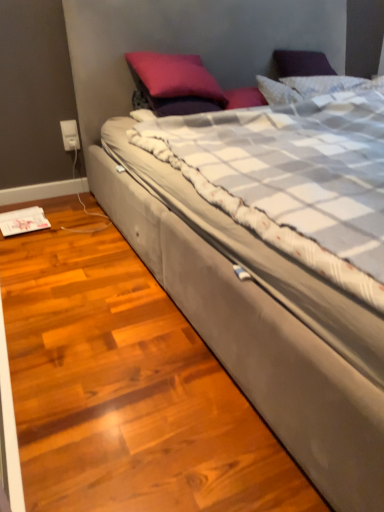
Question: Would you say suede bed at center is to the left or to the right of white plastic electric outlet at lower left in the picture?

Choices:
 (A) left
 (B) right

Answer: (B)

Question: Is suede bed at center in front of or behind white plastic electric outlet at lower left in the image?

Choices:
 (A) behind
 (B) front

Answer: (B)

Question: Which is farther from the satin purple pillow at upper center?

Choices:
 (A) suede bed at center
 (B) white plastic electric outlet at lower left

Answer: (A)

Question: Estimate the real-world distances between objects in this image. Which object is closer to the white plastic electric outlet at lower left?

Choices:
 (A) satin purple pillow at upper center
 (B) suede bed at center

Answer: (A)